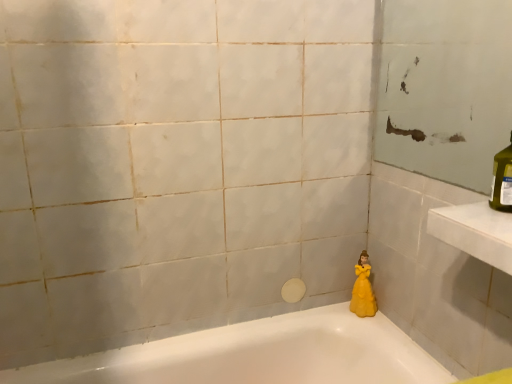
Question: Considering their positions, is yellow matte doll at lower right located in front of or behind white glossy bathtub at lower right?

Choices:
 (A) front
 (B) behind

Answer: (B)

Question: Based on their sizes in the image, would you say yellow matte doll at lower right is bigger or smaller than white glossy bathtub at lower right?

Choices:
 (A) small
 (B) big

Answer: (A)

Question: From the image's perspective, is yellow matte doll at lower right positioned above or below white glossy bathtub at lower right?

Choices:
 (A) above
 (B) below

Answer: (A)

Question: Is white glossy bathtub at lower right taller or shorter than yellow matte doll at lower right?

Choices:
 (A) short
 (B) tall

Answer: (B)

Question: From the image's perspective, relative to yellow matte doll at lower right, is white glossy bathtub at lower right above or below?

Choices:
 (A) above
 (B) below

Answer: (B)

Question: Is white glossy bathtub at lower right to the left or to the right of yellow matte doll at lower right in the image?

Choices:
 (A) right
 (B) left

Answer: (B)

Question: Is white glossy bathtub at lower right wider or thinner than yellow matte doll at lower right?

Choices:
 (A) wide
 (B) thin

Answer: (A)